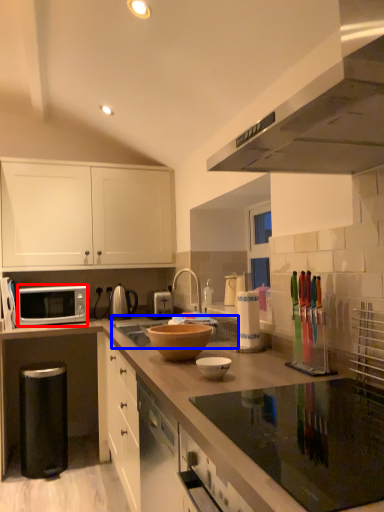
Question: Which of the following is the closest to the observer, microwave oven (highlighted by a red box) or sink (highlighted by a blue box)?

Choices:
 (A) microwave oven
 (B) sink

Answer: (B)